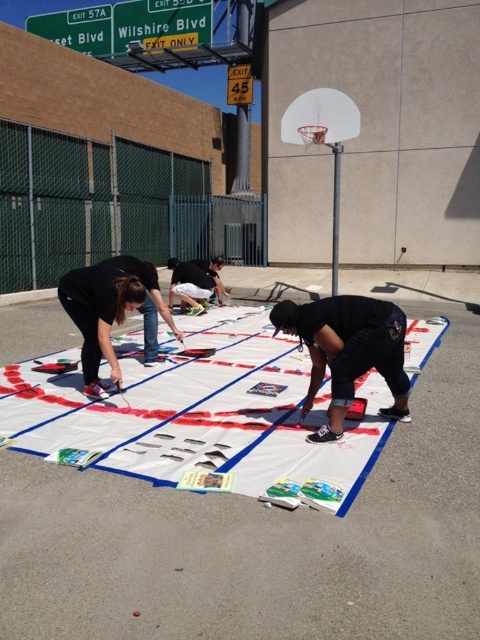
Which of these two, black matte pants at center or white plastic basketball hoop at upper right, stands shorter?

With less height is white plastic basketball hoop at upper right.

Can you confirm if black matte pants at center is positioned to the left of white plastic basketball hoop at upper right?

Yes, black matte pants at center is to the left of white plastic basketball hoop at upper right.

What do you see at coordinates (348, 349) in the screenshot? I see `black matte pants at center` at bounding box center [348, 349].

Find the location of a particular element. black matte pants at center is located at coordinates (348, 349).

Identify the location of greensignboard at upper center. Image resolution: width=480 pixels, height=640 pixels. (160, 22).

Which is more to the right, greensignboard at upper center or green metallic street sign at upper left?

Positioned to the right is greensignboard at upper center.

Find the location of a particular element. The image size is (480, 640). greensignboard at upper center is located at coordinates (160, 22).

Between black matte pants at center and black fabric shirt at center, which one is positioned higher?

black fabric shirt at center is higher up.

Which of these two, black matte pants at center or black fabric shirt at center, stands taller?

Standing taller between the two is black fabric shirt at center.

Does point (385, 376) lie in front of point (182, 305)?

Yes, it is.

Where is `black matte pants at center`? black matte pants at center is located at coordinates (348, 349).